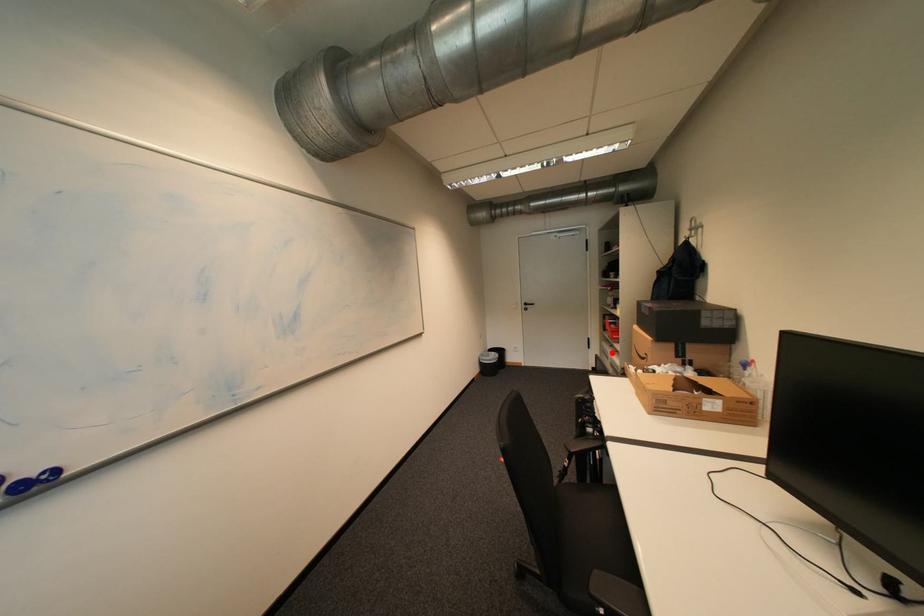
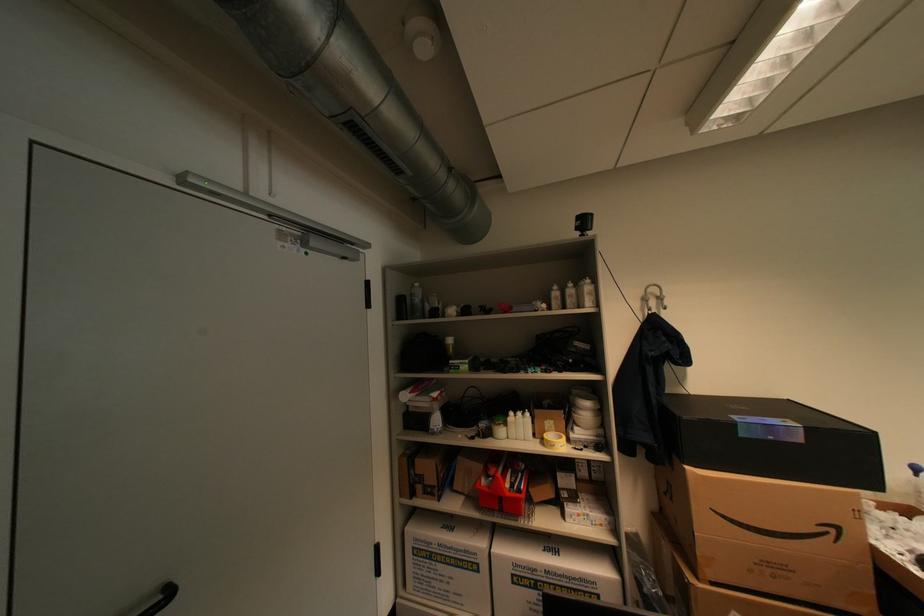
Question: I am providing you with two images of the same scene from different viewpoints. A red point is shown in image1. For the corresponding object point in image2, is it positioned nearer or farther from the camera?

Choices:
 (A) Nearer
 (B) Farther

Answer: (B)